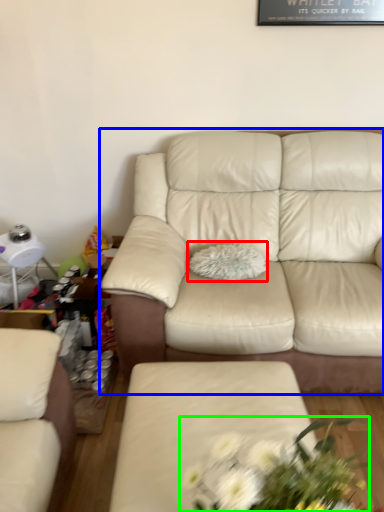
Question: Which object is positioned closest to pillow (highlighted by a red box)? Select from studio couch (highlighted by a blue box) and floral arrangement (highlighted by a green box).

Choices:
 (A) studio couch
 (B) floral arrangement

Answer: (A)